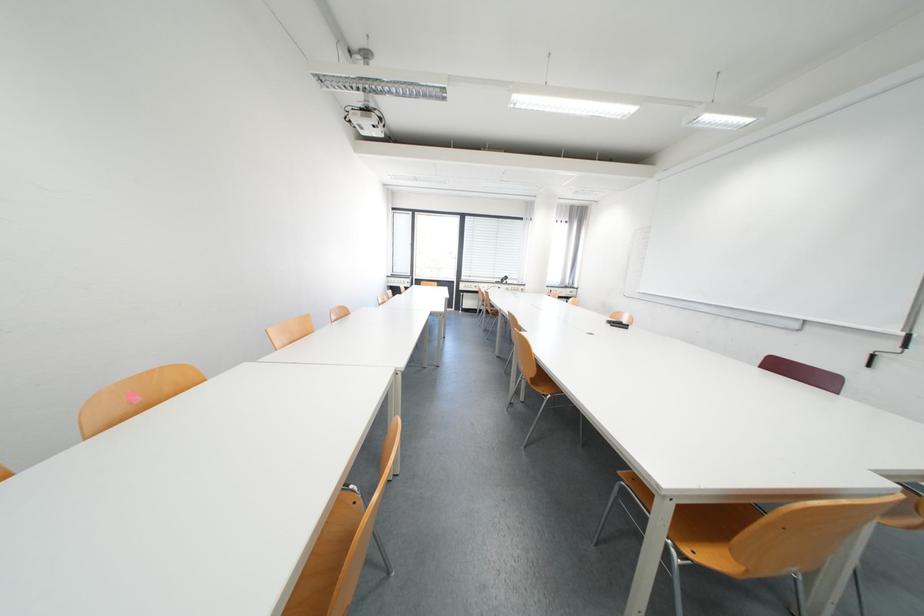
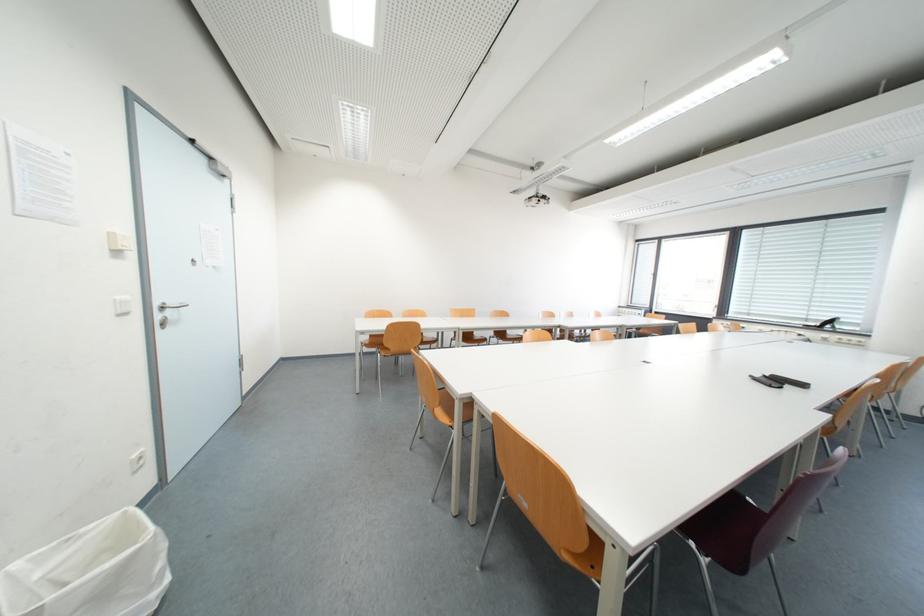
Question: I am providing you with two images of the same scene from different viewpoints. After the viewpoint changes to image2, which objects are now occluded?

Choices:
 (A) metal door handle
 (B) white trash can
 (C) white bench lid
 (D) chair sitting surface

Answer: (D)